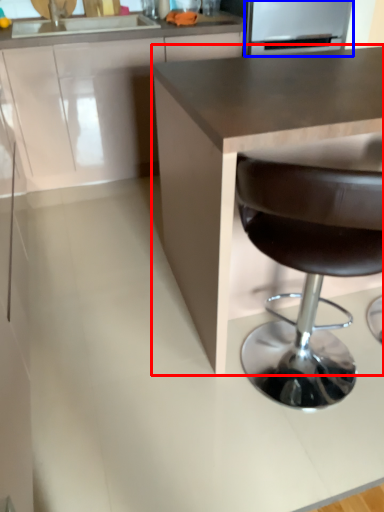
Question: Which object is closer to the camera taking this photo, countertop (highlighted by a red box) or appliance (highlighted by a blue box)?

Choices:
 (A) countertop
 (B) appliance

Answer: (A)